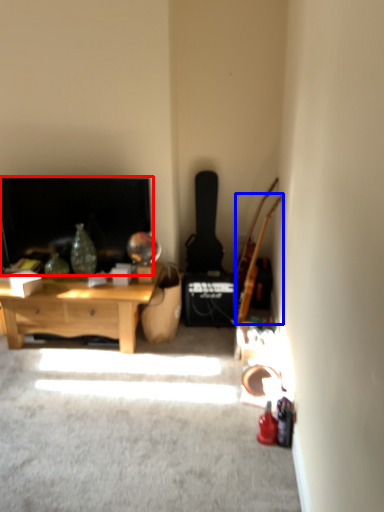
Question: Among these objects, which one is farthest to the camera, fireplace (highlighted by a red box) or guitar (highlighted by a blue box)?

Choices:
 (A) fireplace
 (B) guitar

Answer: (A)